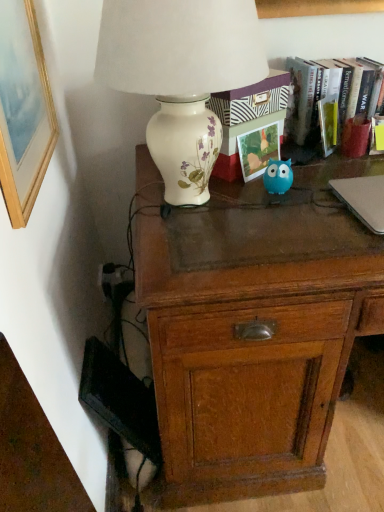
Question: Is there a large distance between porcelain floral lamp at upper left and silver metallic laptop at right?

Choices:
 (A) yes
 (B) no

Answer: (B)

Question: From a real-world perspective, is porcelain floral lamp at upper left positioned over silver metallic laptop at right based on gravity?

Choices:
 (A) no
 (B) yes

Answer: (B)

Question: Can you confirm if porcelain floral lamp at upper left is shorter than silver metallic laptop at right?

Choices:
 (A) no
 (B) yes

Answer: (A)

Question: Can you confirm if porcelain floral lamp at upper left is positioned to the left of silver metallic laptop at right?

Choices:
 (A) no
 (B) yes

Answer: (B)

Question: Would you say porcelain floral lamp at upper left is outside silver metallic laptop at right?

Choices:
 (A) yes
 (B) no

Answer: (A)

Question: Does porcelain floral lamp at upper left have a greater height compared to silver metallic laptop at right?

Choices:
 (A) yes
 (B) no

Answer: (A)

Question: From a real-world perspective, is silver metallic laptop at right over matte paper photo frame at center?

Choices:
 (A) no
 (B) yes

Answer: (A)

Question: Is silver metallic laptop at right at the left side of matte paper photo frame at center?

Choices:
 (A) no
 (B) yes

Answer: (A)

Question: Can you confirm if silver metallic laptop at right is shorter than matte paper photo frame at center?

Choices:
 (A) no
 (B) yes

Answer: (B)

Question: Does silver metallic laptop at right appear on the right side of matte paper photo frame at center?

Choices:
 (A) yes
 (B) no

Answer: (A)

Question: Is silver metallic laptop at right positioned with its back to matte paper photo frame at center?

Choices:
 (A) no
 (B) yes

Answer: (A)

Question: Can you confirm if silver metallic laptop at right is bigger than matte paper photo frame at center?

Choices:
 (A) no
 (B) yes

Answer: (B)

Question: Is hardcover book at upper right behind blue rubber toy at center?

Choices:
 (A) yes
 (B) no

Answer: (A)